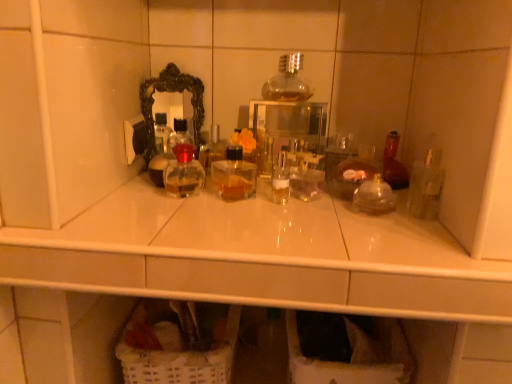
Question: Which direction should I rotate to look at white wicker laundry basket at lower center?

Choices:
 (A) right
 (B) left

Answer: (A)

Question: Considering the relative sizes of white wicker laundry basket at lower center and clear glass bottle at center in the image provided, is white wicker laundry basket at lower center taller than clear glass bottle at center?

Choices:
 (A) no
 (B) yes

Answer: (B)

Question: Considering the relative sizes of white wicker laundry basket at lower center and clear glass bottle at center in the image provided, is white wicker laundry basket at lower center thinner than clear glass bottle at center?

Choices:
 (A) no
 (B) yes

Answer: (A)

Question: From a real-world perspective, does white wicker laundry basket at lower center sit lower than clear glass bottle at center?

Choices:
 (A) yes
 (B) no

Answer: (A)

Question: Is white wicker laundry basket at lower center completely or partially outside of clear glass bottle at center?

Choices:
 (A) yes
 (B) no

Answer: (A)

Question: Does white wicker laundry basket at lower center appear on the right side of clear glass bottle at center?

Choices:
 (A) yes
 (B) no

Answer: (A)

Question: Can you confirm if white wicker laundry basket at lower center is positioned to the left of clear glass bottle at center?

Choices:
 (A) no
 (B) yes

Answer: (A)

Question: Is black ornate mirror at upper center in front of clear glass bottle at center?

Choices:
 (A) yes
 (B) no

Answer: (A)

Question: Is black ornate mirror at upper center thinner than clear glass bottle at center?

Choices:
 (A) no
 (B) yes

Answer: (A)

Question: Considering the relative sizes of black ornate mirror at upper center and clear glass bottle at center in the image provided, is black ornate mirror at upper center wider than clear glass bottle at center?

Choices:
 (A) yes
 (B) no

Answer: (A)

Question: From the image's perspective, is black ornate mirror at upper center located beneath clear glass bottle at center?

Choices:
 (A) yes
 (B) no

Answer: (B)

Question: Does black ornate mirror at upper center appear on the right side of clear glass bottle at center?

Choices:
 (A) no
 (B) yes

Answer: (B)

Question: Considering the relative sizes of black ornate mirror at upper center and clear glass bottle at center in the image provided, is black ornate mirror at upper center taller than clear glass bottle at center?

Choices:
 (A) no
 (B) yes

Answer: (B)

Question: Can you confirm if white wicker laundry basket at lower center is positioned to the left of transparent glass medicine cabinet at center?

Choices:
 (A) no
 (B) yes

Answer: (A)